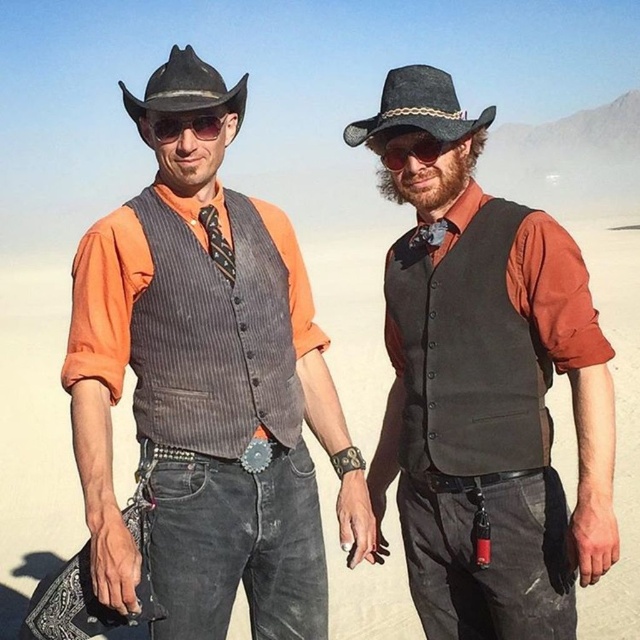
Is matte black sunglasses at upper center thinner than matte black goggles at center?

No.

Who is more forward, (184, 124) or (438, 147)?

Point (438, 147) is more forward.

Between point (144, 122) and point (397, 154), which one is positioned in front?

Point (397, 154) is more forward.

At what (x,y) coordinates should I click in order to perform the action: click on matte black sunglasses at upper center. Please return your answer as a coordinate pair (x, y). Looking at the image, I should click on click(182, 125).

Is black wool vest at center positioned at the back of black felt cowboy hat at upper center?

No.

Does black wool vest at center appear under black felt cowboy hat at upper center?

Indeed, black wool vest at center is positioned under black felt cowboy hat at upper center.

Is point (538, 416) closer to viewer compared to point (380, 99)?

Yes, point (538, 416) is closer to viewer.

At what (x,y) coordinates should I click in order to perform the action: click on black wool vest at center. Please return your answer as a coordinate pair (x, y). The image size is (640, 640). Looking at the image, I should click on (467, 353).

Is the position of pinstriped wool vest at center more distant than that of matte black goggles at center?

Yes.

Does pinstriped wool vest at center have a greater width compared to matte black goggles at center?

Indeed, pinstriped wool vest at center has a greater width compared to matte black goggles at center.

Image resolution: width=640 pixels, height=640 pixels. I want to click on pinstriped wool vest at center, so click(x=212, y=337).

Where is `pinstriped wool vest at center`? pinstriped wool vest at center is located at coordinates (212, 337).